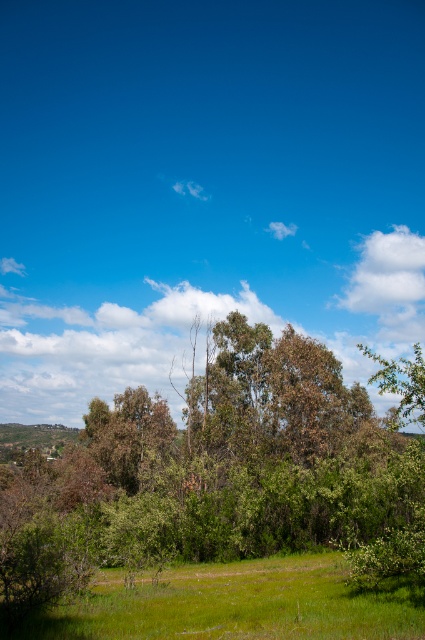
Question: Estimate the real-world distances between objects in this image. Which object is closer to the white fluffy cloud at upper right?

Choices:
 (A) green leafy tree at center
 (B) green grass at lower center

Answer: (A)

Question: Is green leafy tree at center in front of green grass at lower center?

Choices:
 (A) yes
 (B) no

Answer: (B)

Question: Which object is closer to the camera taking this photo?

Choices:
 (A) green leafy tree at center
 (B) white fluffy cloud at upper right
 (C) green grass at lower center

Answer: (C)

Question: Considering the real-world distances, which object is closest to the white fluffy cloud at upper right?

Choices:
 (A) green grass at lower center
 (B) green leafy tree at center

Answer: (B)

Question: Is green grass at lower center bigger than white fluffy cloud at upper right?

Choices:
 (A) yes
 (B) no

Answer: (B)

Question: Does green grass at lower center have a lesser width compared to white fluffy cloud at upper right?

Choices:
 (A) no
 (B) yes

Answer: (B)